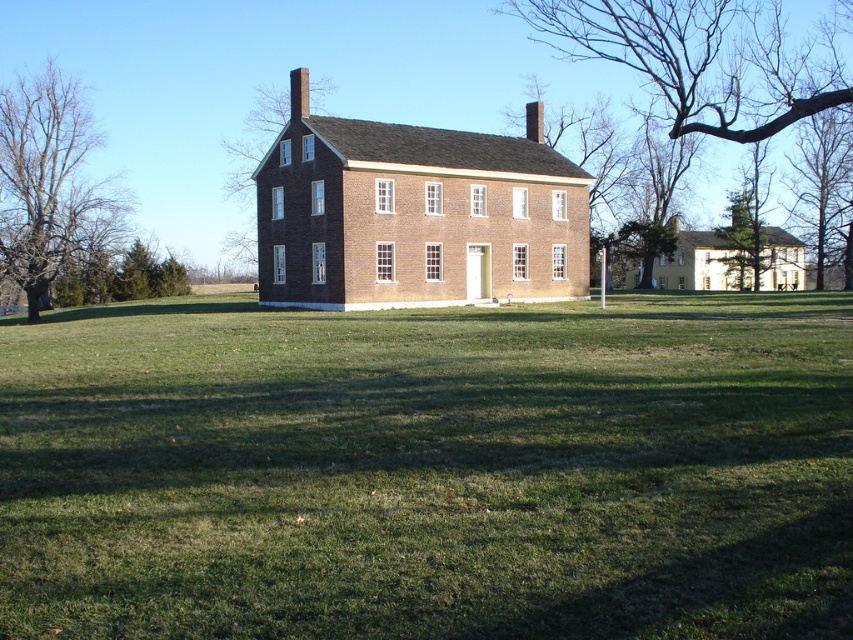
You are standing at the point marked by the coordinates point (428, 470) in the image. According to the scene description, what is the immediate surface you are standing on?

The point (428, 470) indicates green grass at center, so you are standing on green grass at center.

In the scene shown: You are standing in the front yard of the house and notice two trees. One is the bare branches at upper center and the other is the bare wood tree at left. Which of these two has a wider spread of branches?

The bare branches at upper center has a larger width than the bare wood tree at left, so the bare branches at upper center has a wider spread of branches.